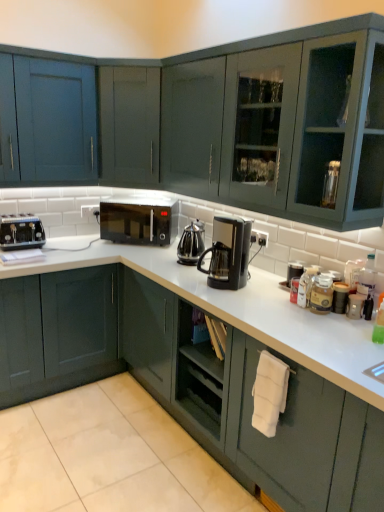
The width and height of the screenshot is (384, 512). I want to click on free space above white matte towel at lower right (from a real-world perspective), so click(x=332, y=329).